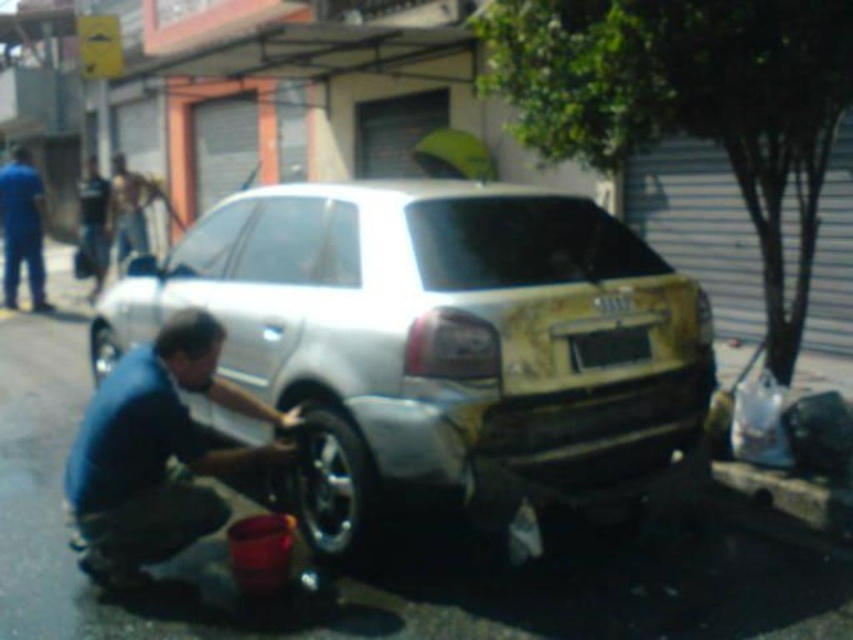
Image resolution: width=853 pixels, height=640 pixels. What do you see at coordinates (436, 340) in the screenshot?
I see `silver metallic car at center` at bounding box center [436, 340].

Who is shorter, silver metallic car at center or black plastic license plate at rear?

black plastic license plate at rear

What are the coordinates of `silver metallic car at center` in the screenshot? It's located at (436, 340).

Who is higher up, silver metallic car at center or blue fabric shirt at lower left?

Result: blue fabric shirt at lower left

Does silver metallic car at center have a greater width compared to blue fabric shirt at lower left?

Yes, silver metallic car at center is wider than blue fabric shirt at lower left.

Between point (527, 208) and point (115, 157), which one is positioned in front?

Point (527, 208) is more forward.

Image resolution: width=853 pixels, height=640 pixels. Identify the location of silver metallic car at center. (436, 340).

Is silver metallic car at center below blue uniform at left?

Correct, silver metallic car at center is located below blue uniform at left.

Which is more to the right, silver metallic car at center or blue uniform at left?

From the viewer's perspective, silver metallic car at center appears more on the right side.

Is point (546, 465) less distant than point (10, 204)?

Yes, it is.

Image resolution: width=853 pixels, height=640 pixels. In order to click on silver metallic car at center in this screenshot , I will do `click(436, 340)`.